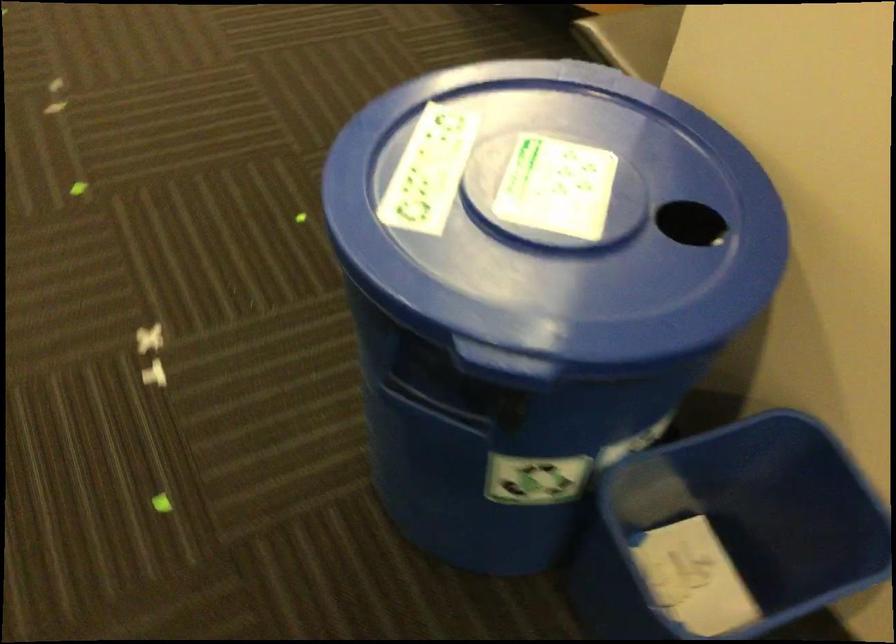
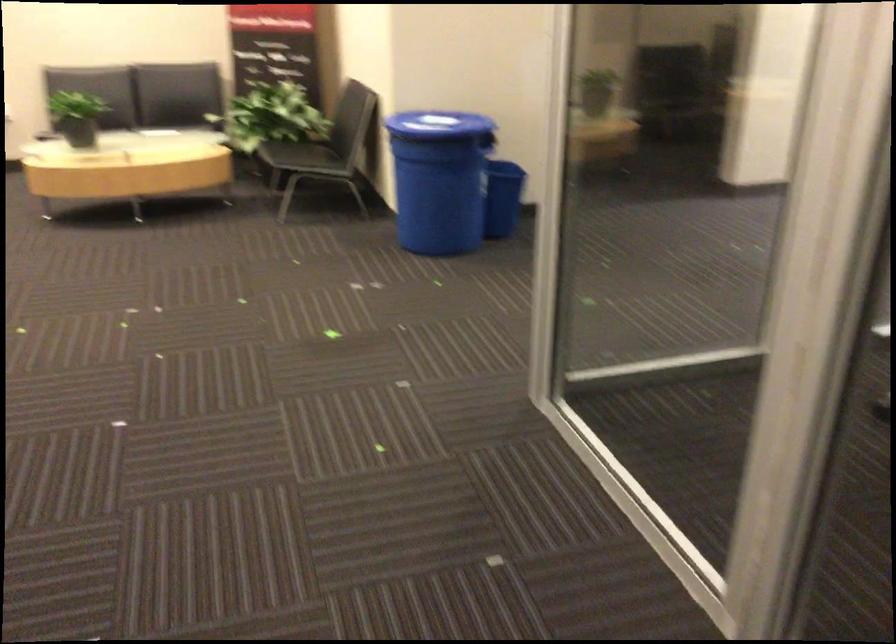
Question: I am providing you with two images of the same scene from different viewpoints. Which of the following objects are not visible in image2?

Choices:
 (A) black chair sitting surface
 (B) small blue trash can
 (C) black control dial
 (D) small blue trashcan

Answer: (D)